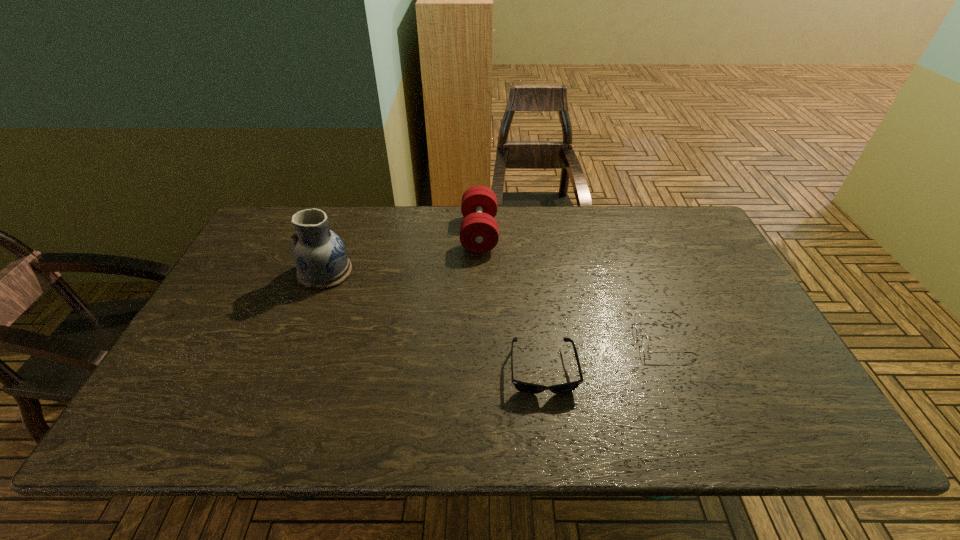
Identify which object is the second closest to the spectacles. Please provide its 2D coordinates. Your answer should be formatted as a tuple, i.e. [(x, y)], where the tuple contains the x and y coordinates of a point satisfying the conditions above.

[(479, 233)]

Locate an element on the screen. This screenshot has height=540, width=960. vacant region that satisfies the following two spatial constraints: 1. on the front-facing side of the rightmost object; 2. on the front-facing side of the sunglasses is located at coordinates (676, 370).